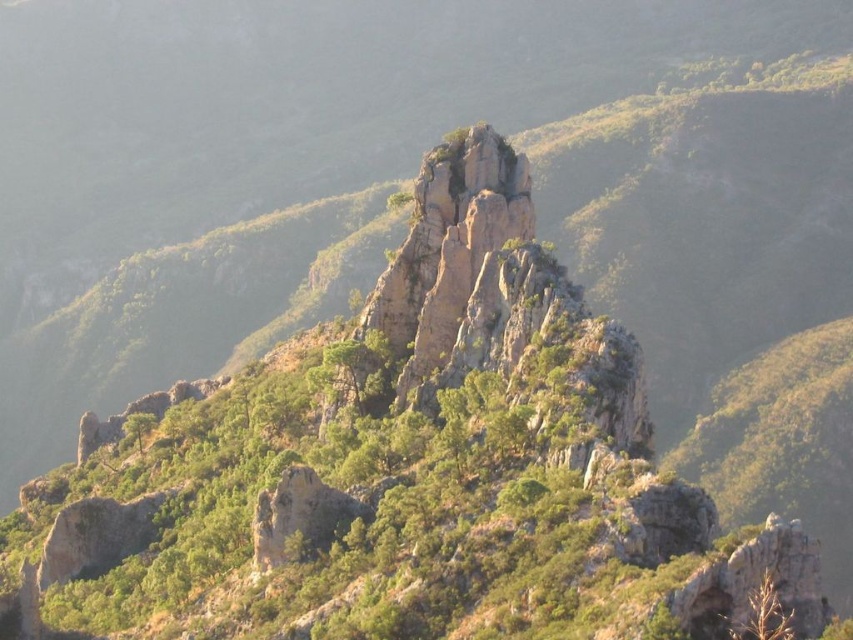
Question: Which of the following is the closest to the observer?

Choices:
 (A) rough textured rock at center
 (B) rugged stone rock at center

Answer: (A)

Question: Does rugged stone rock at center appear on the left side of rough textured rock at center?

Choices:
 (A) no
 (B) yes

Answer: (A)

Question: Does rugged stone rock at center have a lesser width compared to rough textured rock at center?

Choices:
 (A) yes
 (B) no

Answer: (B)

Question: Which of the following is the farthest from the observer?

Choices:
 (A) rugged stone rock at center
 (B) rough textured rock at center

Answer: (A)

Question: Is rugged stone rock at center below rough textured rock at center?

Choices:
 (A) yes
 (B) no

Answer: (B)